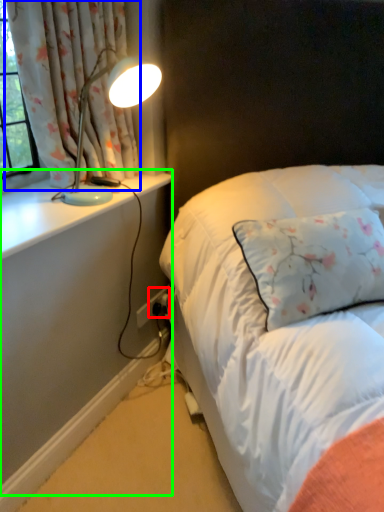
Question: Which is farther away from electric outlet (highlighted by a red box)? curtain (highlighted by a blue box) or dresser (highlighted by a green box)?

Choices:
 (A) curtain
 (B) dresser

Answer: (A)